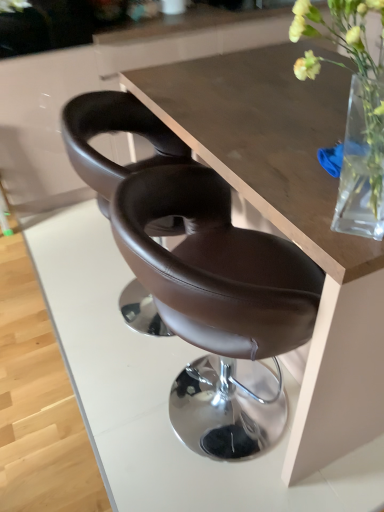
At what (x,y) coordinates should I click in order to perform the action: click on brown leather chair at center, the second chair viewed from the front. Please return your answer as a coordinate pair (x, y). Looking at the image, I should click on (114, 132).

This screenshot has height=512, width=384. I want to click on brown leather chair at center, the second chair viewed from the front, so click(114, 132).

From the image's perspective, which one is positioned lower, brown leather chair at center, the 2th chair when ordered from back to front, or wooden table at center?

brown leather chair at center, the 2th chair when ordered from back to front, is shown below in the image.

How different are the orientations of brown leather chair at center, the 2th chair when ordered from back to front, and wooden table at center in degrees?

The angular difference between brown leather chair at center, the 2th chair when ordered from back to front, and wooden table at center is 90 degrees.

Which point is more distant from viewer, (258, 355) or (324, 128)?

The point (324, 128) is farther from the camera.

Is brown leather chair at center, which is counted as the 1th chair, starting from the front, not close to wooden table at center?

No, brown leather chair at center, which is counted as the 1th chair, starting from the front, is in close proximity to wooden table at center.

From the image's perspective, between translucent glass vase at upper right and wooden table at center, who is located below?

translucent glass vase at upper right appears lower in the image.

Is translucent glass vase at upper right not near wooden table at center?

Actually, translucent glass vase at upper right and wooden table at center are a little close together.

How many degrees apart are the facing directions of translucent glass vase at upper right and wooden table at center?

The facing directions of translucent glass vase at upper right and wooden table at center are 88.6 degrees apart.

Is wooden table at center a part of translucent glass vase at upper right?

No, translucent glass vase at upper right does not contain wooden table at center.

Is translucent glass vase at upper right at the back of white matte flower at upper center?

white matte flower at upper center does not have its back to translucent glass vase at upper right.

In the image, is white matte flower at upper center positioned in front of or behind translucent glass vase at upper right?

white matte flower at upper center is positioned farther from the viewer than translucent glass vase at upper right.

From a real-world perspective, is white matte flower at upper center positioned over translucent glass vase at upper right based on gravity?

Yes, from a real-world perspective, white matte flower at upper center is over translucent glass vase at upper right

From the image's perspective, is white matte flower at upper center on translucent glass vase at upper right?

Indeed, from the image's perspective, white matte flower at upper center is shown above translucent glass vase at upper right.

Is brown leather chair at center, the 2th chair when ordered from back to front, oriented towards translucent glass vase at upper right?

No, brown leather chair at center, the 2th chair when ordered from back to front, does not turn towards translucent glass vase at upper right.

From the image's perspective, is brown leather chair at center, which is counted as the 1th chair, starting from the front, over translucent glass vase at upper right?

No.

Locate an element on the screen. the 2nd chair positioned below the translucent glass vase at upper right (from the image's perspective) is located at coordinates (219, 305).

Where is `chair above the brown leather chair at center, the 2th chair when ordered from back to front (from the image's perspective)`? This screenshot has width=384, height=512. chair above the brown leather chair at center, the 2th chair when ordered from back to front (from the image's perspective) is located at coordinates (114, 132).

From the image's perspective, is brown leather chair at center, positioned as the 1th chair in back-to-front order, located above or below brown leather chair at center, which is counted as the 1th chair, starting from the front?

brown leather chair at center, positioned as the 1th chair in back-to-front order, is situated higher than brown leather chair at center, which is counted as the 1th chair, starting from the front, in the image.

Which is behind, point (99, 206) or point (309, 289)?

The point (99, 206) is more distant.

Is brown leather chair at center, the second chair viewed from the front, beside brown leather chair at center, the 2th chair when ordered from back to front?

brown leather chair at center, the second chair viewed from the front, is not next to brown leather chair at center, the 2th chair when ordered from back to front, and they're not touching.

What's the angular difference between translucent glass vase at upper right and brown leather chair at center, the second chair viewed from the front,'s facing directions?

They differ by 179 degrees in their facing directions.

Which is closer, (348, 226) or (127, 320)?

Point (348, 226) is closer to the camera than point (127, 320).

Which of these two, translucent glass vase at upper right or brown leather chair at center, positioned as the 1th chair in back-to-front order, is bigger?

With larger size is brown leather chair at center, positioned as the 1th chair in back-to-front order.

From a real-world perspective, is translucent glass vase at upper right physically below brown leather chair at center, positioned as the 1th chair in back-to-front order?

Incorrect, from a real-world perspective, translucent glass vase at upper right is higher than brown leather chair at center, positioned as the 1th chair in back-to-front order.

Does brown leather chair at center, which is counted as the 1th chair, starting from the front, appear on the right side of brown leather chair at center, the second chair viewed from the front?

Indeed, brown leather chair at center, which is counted as the 1th chair, starting from the front, is positioned on the right side of brown leather chair at center, the second chair viewed from the front.

Which object is thinner, brown leather chair at center, the 2th chair when ordered from back to front, or brown leather chair at center, the second chair viewed from the front?

brown leather chair at center, the 2th chair when ordered from back to front, is thinner.

Which object is closer to the camera, brown leather chair at center, which is counted as the 1th chair, starting from the front, or brown leather chair at center, positioned as the 1th chair in back-to-front order?

brown leather chair at center, which is counted as the 1th chair, starting from the front.

Could you tell me if brown leather chair at center, which is counted as the 1th chair, starting from the front, is facing brown leather chair at center, positioned as the 1th chair in back-to-front order?

No, brown leather chair at center, which is counted as the 1th chair, starting from the front, is not aimed at brown leather chair at center, positioned as the 1th chair in back-to-front order.

Which chair is the 2nd one when counting from the front of the wooden table at center? Please provide its 2D coordinates.

[(219, 305)]

Identify the location of floral arrangement above the wooden table at center (from a real-world perspective). (356, 115).

Based on their spatial positions, is translucent glass vase at upper right or white matte flower at upper center further from wooden table at center?

white matte flower at upper center.

From the image, which object appears to be farther from brown leather chair at center, positioned as the 1th chair in back-to-front order, white matte flower at upper center or wooden table at center?

white matte flower at upper center.

From the image, which object appears to be nearer to white matte flower at upper center, translucent glass vase at upper right or brown leather chair at center, positioned as the 1th chair in back-to-front order?

Based on the image, brown leather chair at center, positioned as the 1th chair in back-to-front order, appears to be nearer to white matte flower at upper center.

Estimate the real-world distances between objects in this image. Which object is further from translucent glass vase at upper right, wooden table at center or brown leather chair at center, the 2th chair when ordered from back to front?

wooden table at center lies further to translucent glass vase at upper right than the other object.

Estimate the real-world distances between objects in this image. Which object is closer to brown leather chair at center, the second chair viewed from the front, translucent glass vase at upper right or wooden table at center?

Result: wooden table at center is closer to brown leather chair at center, the second chair viewed from the front.

Estimate the real-world distances between objects in this image. Which object is closer to wooden table at center, white matte flower at upper center or brown leather chair at center, positioned as the 1th chair in back-to-front order?

brown leather chair at center, positioned as the 1th chair in back-to-front order, is positioned closer to the anchor wooden table at center.

Considering their positions, is brown leather chair at center, the 2th chair when ordered from back to front, positioned further to brown leather chair at center, the second chair viewed from the front, than translucent glass vase at upper right?

translucent glass vase at upper right is positioned further to the anchor brown leather chair at center, the second chair viewed from the front.

From the image, which object appears to be nearer to wooden table at center, brown leather chair at center, positioned as the 1th chair in back-to-front order, or brown leather chair at center, which is counted as the 1th chair, starting from the front?

brown leather chair at center, positioned as the 1th chair in back-to-front order, is positioned closer to the anchor wooden table at center.

The image size is (384, 512). Find the location of `floral arrangement between white matte flower at upper center and brown leather chair at center, the 2th chair when ordered from back to front, in the vertical direction`. floral arrangement between white matte flower at upper center and brown leather chair at center, the 2th chair when ordered from back to front, in the vertical direction is located at coordinates (356, 115).

Where is `floral arrangement that lies between wooden table at center and brown leather chair at center, which is counted as the 1th chair, starting from the front, from top to bottom`? floral arrangement that lies between wooden table at center and brown leather chair at center, which is counted as the 1th chair, starting from the front, from top to bottom is located at coordinates (356, 115).

Where is `chair between translucent glass vase at upper right and brown leather chair at center, the second chair viewed from the front, from front to back`? This screenshot has height=512, width=384. chair between translucent glass vase at upper right and brown leather chair at center, the second chair viewed from the front, from front to back is located at coordinates click(x=219, y=305).

This screenshot has height=512, width=384. Find the location of `floral arrangement that lies between white matte flower at upper center and brown leather chair at center, positioned as the 1th chair in back-to-front order, from top to bottom`. floral arrangement that lies between white matte flower at upper center and brown leather chair at center, positioned as the 1th chair in back-to-front order, from top to bottom is located at coordinates click(356, 115).